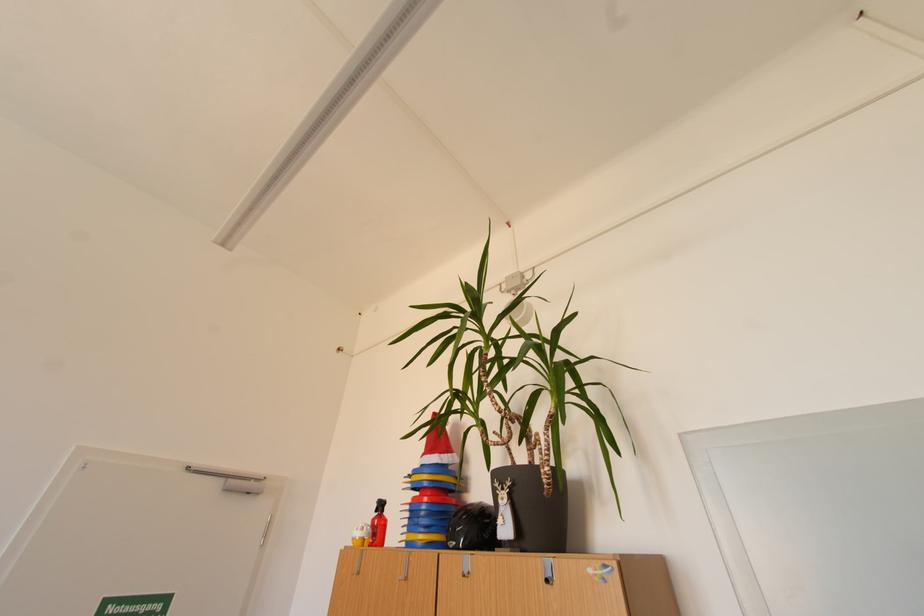
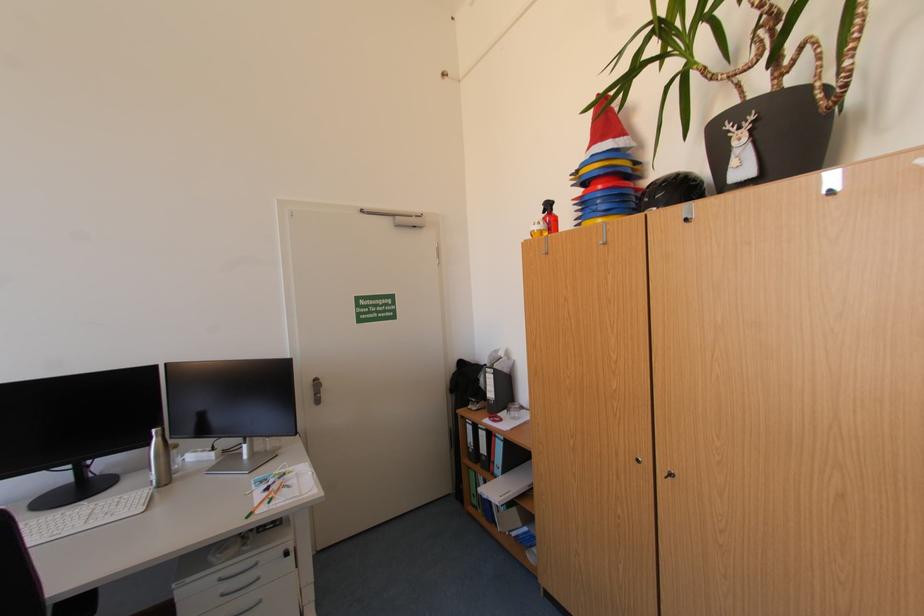
Locate, in the second image, the point that corresponds to (x=383, y=512) in the first image.

(552, 213)